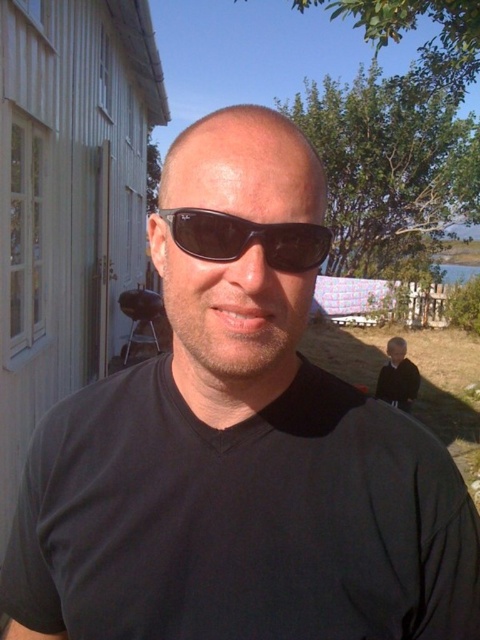
You are trying to locate two specific points in the image. The first point is at coordinates point (260, 234) and the second is at point (414, 397). Which of these two points is closer to the viewer?

Point (260, 234) is in front of point (414, 397), so it is closer to the viewer.

You are trying to decide whether to place a small potted plant between the black plastic sunglasses at center and the black fabric child at lower right. Based on their heights, which object should the plant be placed closer to?

The black plastic sunglasses at center is not as tall as the black fabric child at lower right, so the plant should be placed closer to the black fabric child at lower right to maintain visual balance.

You are a photographer trying to capture a shot of the black plastic sunglasses at center and the black fabric child at lower right. Based on their positions, which object is positioned higher in the image?

The black plastic sunglasses at center is located above the black fabric child at lower right, so it is positioned higher in the image.